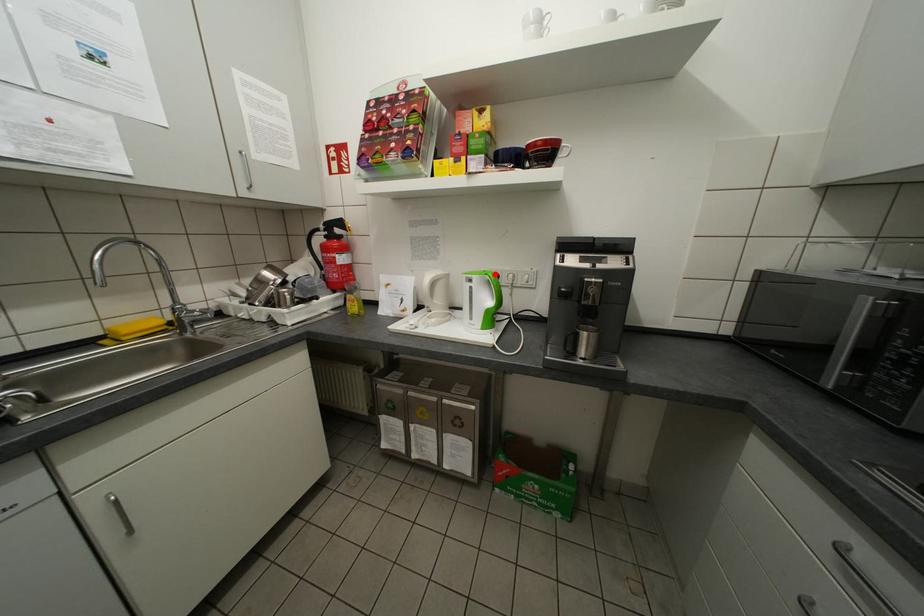
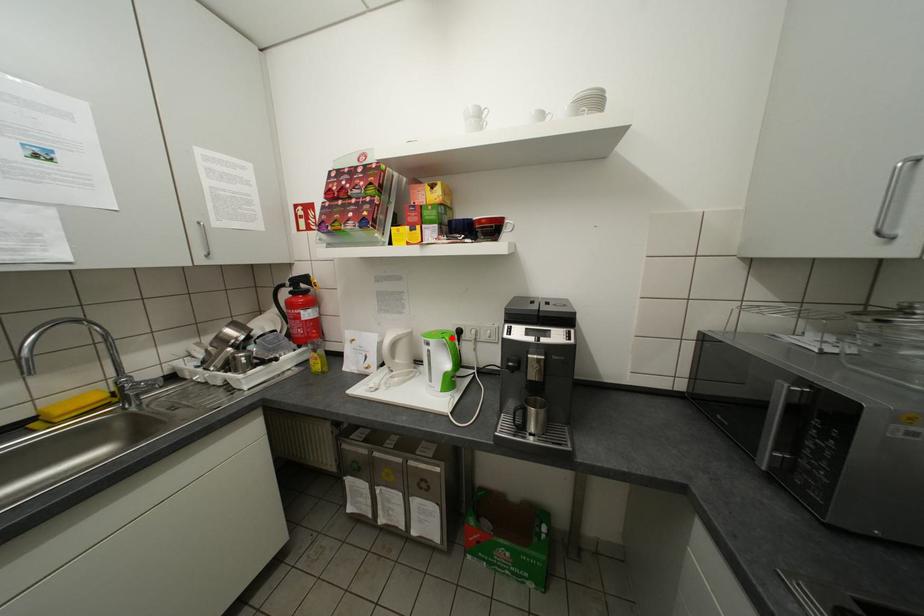
I am providing you with two images of the same scene from different viewpoints. A red point is marked on the first image and another point is marked on the second image. Do the highlighted points in image1 and image2 indicate the same real-world spot?

Yes